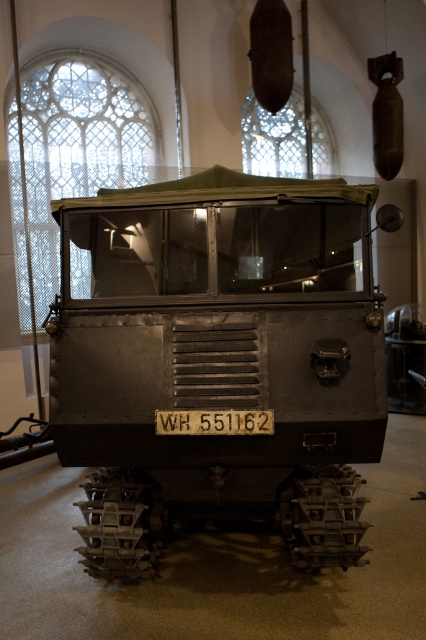
Which is behind, point (314, 353) or point (255, 413)?

Point (314, 353)

Is point (109, 472) closer to viewer compared to point (268, 410)?

No, it is not.

Which is in front, point (221, 388) or point (233, 412)?

Point (233, 412) is in front.

The width and height of the screenshot is (426, 640). I want to click on matte gray train car at center, so click(x=218, y=356).